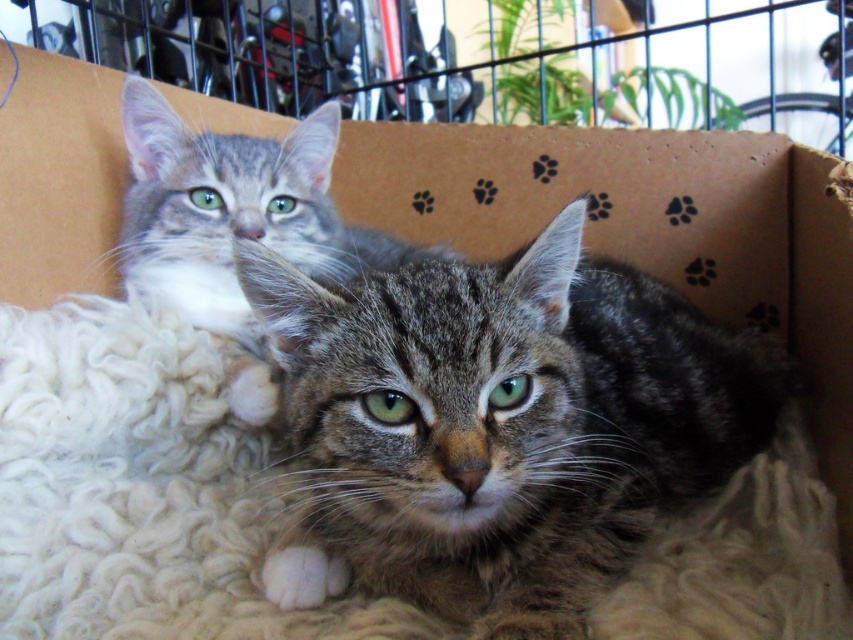
Question: Where is tabby fur cat at center located in relation to tabby fur cat at upper left in the image?

Choices:
 (A) left
 (B) right

Answer: (B)

Question: Which point appears closest to the camera in this image?

Choices:
 (A) (258, 289)
 (B) (312, 237)

Answer: (A)

Question: Does tabby fur cat at center come behind tabby fur cat at upper left?

Choices:
 (A) yes
 (B) no

Answer: (B)

Question: Is tabby fur cat at center to the right of tabby fur cat at upper left from the viewer's perspective?

Choices:
 (A) no
 (B) yes

Answer: (B)